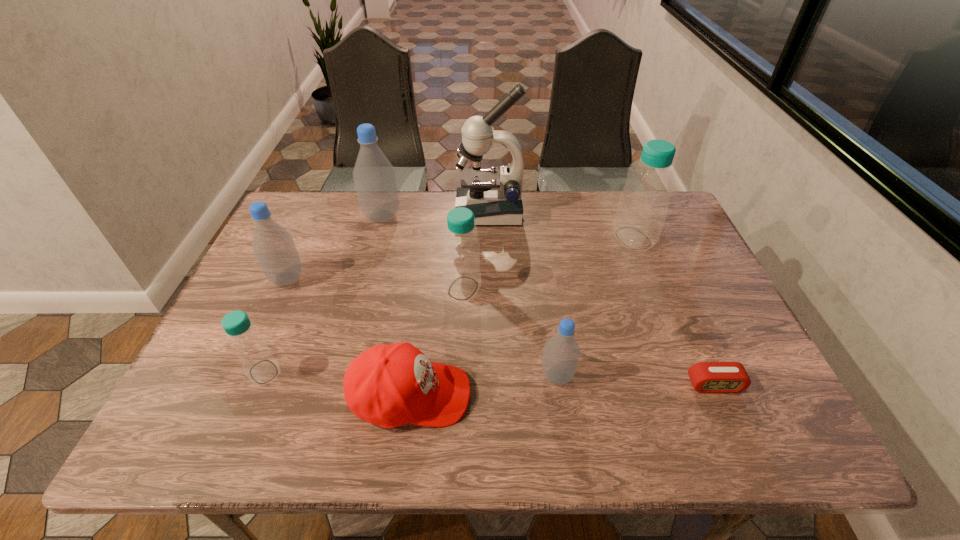
What are the coordinates of `alarm clock that is at the right edge` in the screenshot? It's located at [706, 377].

Where is `object that is at the far right corner`? object that is at the far right corner is located at coordinates (643, 204).

At what (x,y) coordinates should I click in order to perform the action: click on vacant region at the far edge of the desktop. Please return your answer as a coordinate pair (x, y). The height and width of the screenshot is (540, 960). Looking at the image, I should click on (582, 198).

At what (x,y) coordinates should I click in order to perform the action: click on free space at the near edge of the desktop. Please return your answer as a coordinate pair (x, y). Looking at the image, I should click on (301, 422).

This screenshot has width=960, height=540. I want to click on free space at the right edge of the desktop, so click(669, 274).

Where is `unoccupied position between the biggest gray bottle and the second shortest object`? unoccupied position between the biggest gray bottle and the second shortest object is located at coordinates (396, 306).

Where is `free space between the leftmost gray bottle and the nearest blue bottle`? Image resolution: width=960 pixels, height=540 pixels. free space between the leftmost gray bottle and the nearest blue bottle is located at coordinates (276, 325).

The width and height of the screenshot is (960, 540). I want to click on free point between the second gray bottle from left to right and the second nearest gray bottle, so click(x=334, y=247).

This screenshot has height=540, width=960. What are the coordinates of `vacant area between the second shortest object and the second nearest blue bottle` in the screenshot? It's located at (437, 342).

What are the coordinates of `free space between the second shortest object and the second nearest gray bottle` in the screenshot? It's located at (348, 337).